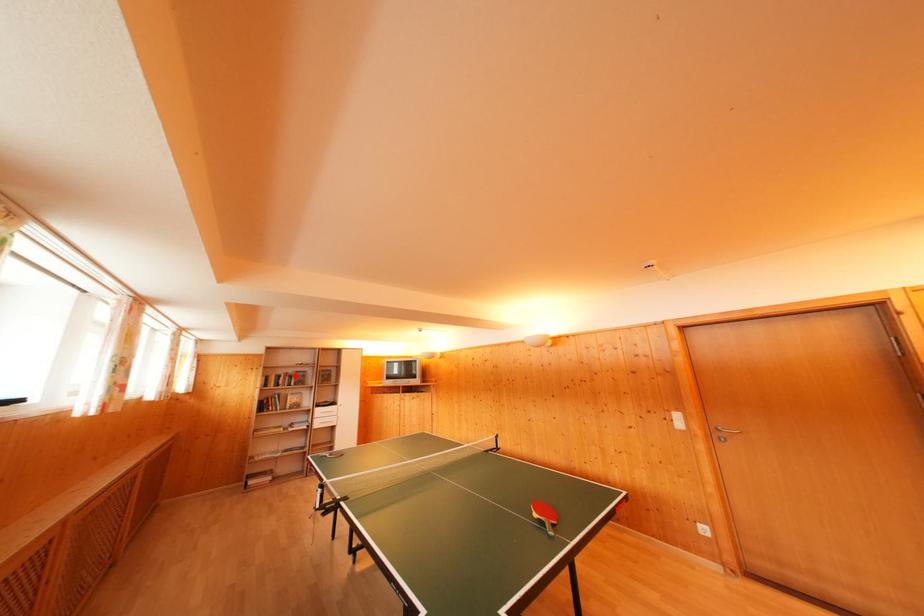
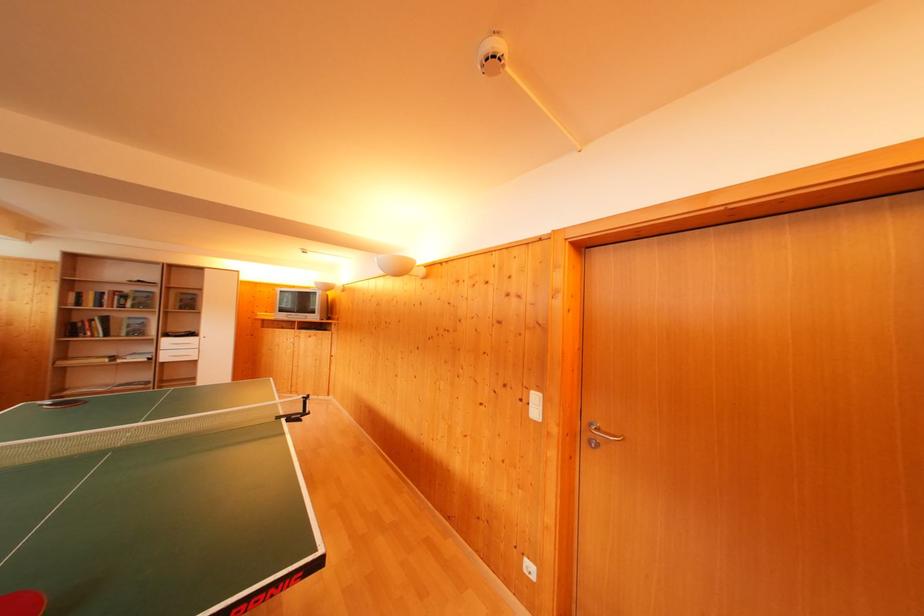
The point at the highlighted location is marked in the first image. Where is the corresponding point in the second image?

(131, 294)